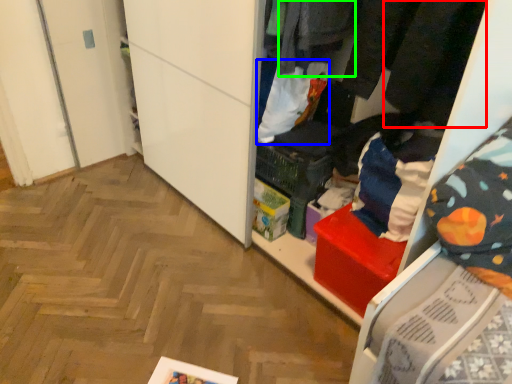
Question: Estimate the real-world distances between objects in this image. Which object is closer to clothing (highlighted by a red box), clothing (highlighted by a blue box) or clothing (highlighted by a green box)?

Choices:
 (A) clothing
 (B) clothing

Answer: (B)